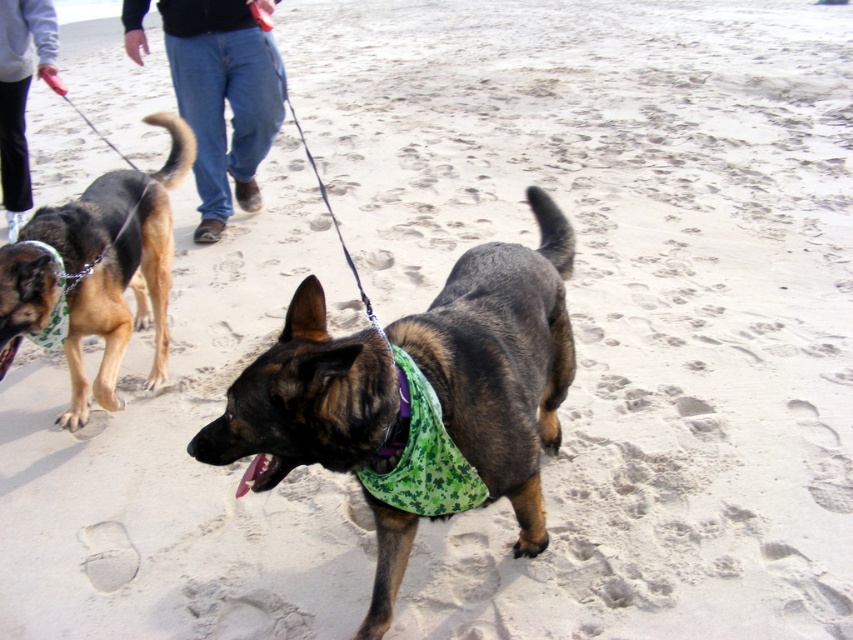
You are standing at the origin point of the coordinate system. You see two points, point (0, 364) and point (399, 541). Which point is closer to you?

Point (0, 364) is behind point (399, 541), so the point closer to you is point (399, 541).

You are a photographer at the beach and want to capture a closeup of the green fabric bandana at center without the brown fur dog at center blocking it. Is this possible?

The brown fur dog at center is located above the green fabric bandana at center, so the dog would block the bandana in the photo. You cannot capture a closeup of the green fabric bandana at center without the brown fur dog at center blocking it.